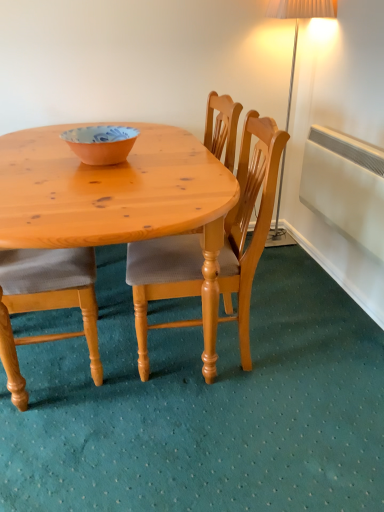
Question: Is light brown wooden chair at center next to matte orange bowl at center?

Choices:
 (A) no
 (B) yes

Answer: (A)

Question: Is light brown wooden chair at center oriented away from matte orange bowl at center?

Choices:
 (A) yes
 (B) no

Answer: (B)

Question: Is light brown wooden chair at center bigger than matte orange bowl at center?

Choices:
 (A) yes
 (B) no

Answer: (A)

Question: From the image's perspective, is light brown wooden chair at center over matte orange bowl at center?

Choices:
 (A) yes
 (B) no

Answer: (B)

Question: Can you confirm if light brown wooden chair at center is wider than matte orange bowl at center?

Choices:
 (A) no
 (B) yes

Answer: (B)

Question: Considering the relative positions of white plastic radiator at right and light brown wooden chair at center in the image provided, is white plastic radiator at right to the left or to the right of light brown wooden chair at center?

Choices:
 (A) left
 (B) right

Answer: (B)

Question: From their relative heights in the image, would you say white plastic radiator at right is taller or shorter than light brown wooden chair at center?

Choices:
 (A) short
 (B) tall

Answer: (A)

Question: From a real-world perspective, is white plastic radiator at right above or below light brown wooden chair at center?

Choices:
 (A) above
 (B) below

Answer: (A)

Question: In the image, is white plastic radiator at right positioned in front of or behind light brown wooden chair at center?

Choices:
 (A) behind
 (B) front

Answer: (A)

Question: Based on their sizes in the image, would you say matte orange bowl at center is bigger or smaller than light brown wooden chair at center?

Choices:
 (A) small
 (B) big

Answer: (A)

Question: In the image, is matte orange bowl at center positioned in front of or behind light brown wooden chair at center?

Choices:
 (A) behind
 (B) front

Answer: (A)

Question: From the image's perspective, is matte orange bowl at center above or below light brown wooden chair at center?

Choices:
 (A) below
 (B) above

Answer: (B)

Question: Would you say matte orange bowl at center is inside or outside light brown wooden chair at center?

Choices:
 (A) inside
 (B) outside

Answer: (B)

Question: In terms of width, does light brown wooden chair at center look wider or thinner when compared to matte orange bowl at center?

Choices:
 (A) thin
 (B) wide

Answer: (B)

Question: Based on their positions, is light brown wooden chair at center located to the left or right of matte orange bowl at center?

Choices:
 (A) right
 (B) left

Answer: (A)